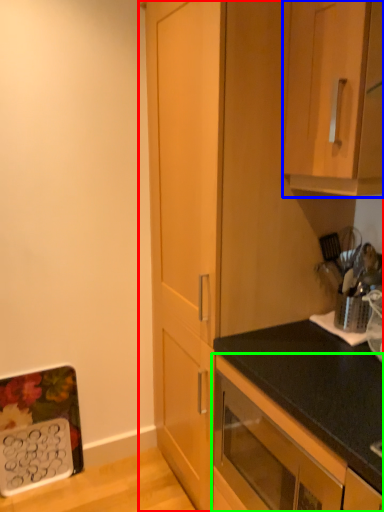
Question: Based on their relative distances, which object is farther from cabinetry (highlighted by a red box)? Choose from cabinetry (highlighted by a blue box) and cabinetry (highlighted by a green box).

Choices:
 (A) cabinetry
 (B) cabinetry

Answer: (B)